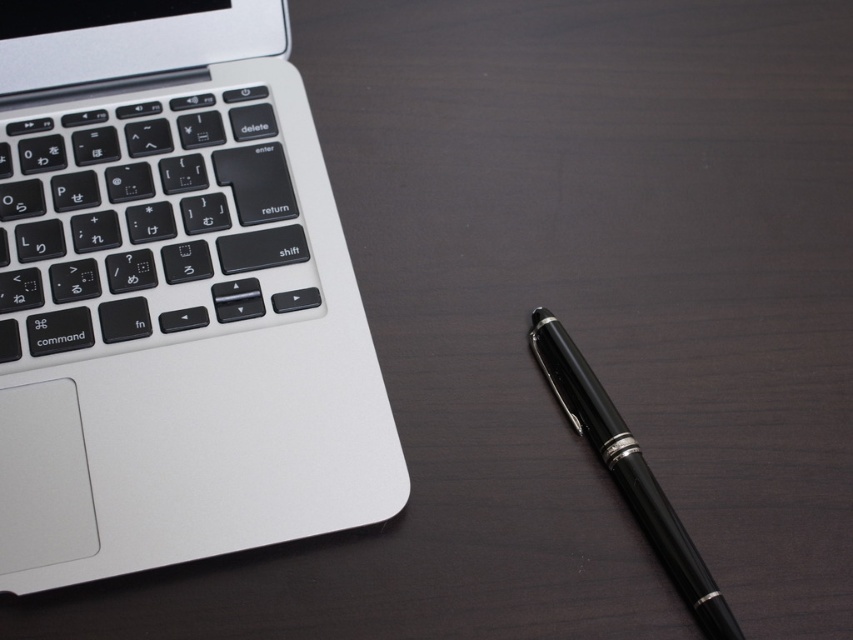
The height and width of the screenshot is (640, 853). What do you see at coordinates (172, 296) in the screenshot?
I see `sleek silver laptop at upper left` at bounding box center [172, 296].

Between point (155, 150) and point (601, 438), which one is positioned behind?

Point (155, 150)

Locate an element on the screen. The height and width of the screenshot is (640, 853). sleek silver laptop at upper left is located at coordinates (172, 296).

Identify the location of sleek silver laptop at upper left. The width and height of the screenshot is (853, 640). (172, 296).

Locate an element on the screen. This screenshot has height=640, width=853. black matte keyboard at left is located at coordinates (146, 225).

Based on the photo, is black matte keyboard at left bigger than black polished pen at lower right?

Yes, black matte keyboard at left is bigger than black polished pen at lower right.

Is point (165, 326) positioned before point (587, 371)?

Yes, it is.

You are a GUI agent. You are given a task and a screenshot of the screen. Output one action in this format:
    pyautogui.click(x=<x>, y=<y>)
    Task: Click on the black matte keyboard at left
    This screenshot has height=640, width=853.
    Given the screenshot: What is the action you would take?
    (x=146, y=225)

Is sleek silver laptop at upper left positioned at the back of black matte keyboard at left?

No, it is in front of black matte keyboard at left.

Is point (67, 51) in front of point (289, 252)?

No, it is not.

The height and width of the screenshot is (640, 853). In order to click on sleek silver laptop at upper left in this screenshot , I will do `click(172, 296)`.

Image resolution: width=853 pixels, height=640 pixels. In order to click on sleek silver laptop at upper left in this screenshot , I will do `click(172, 296)`.